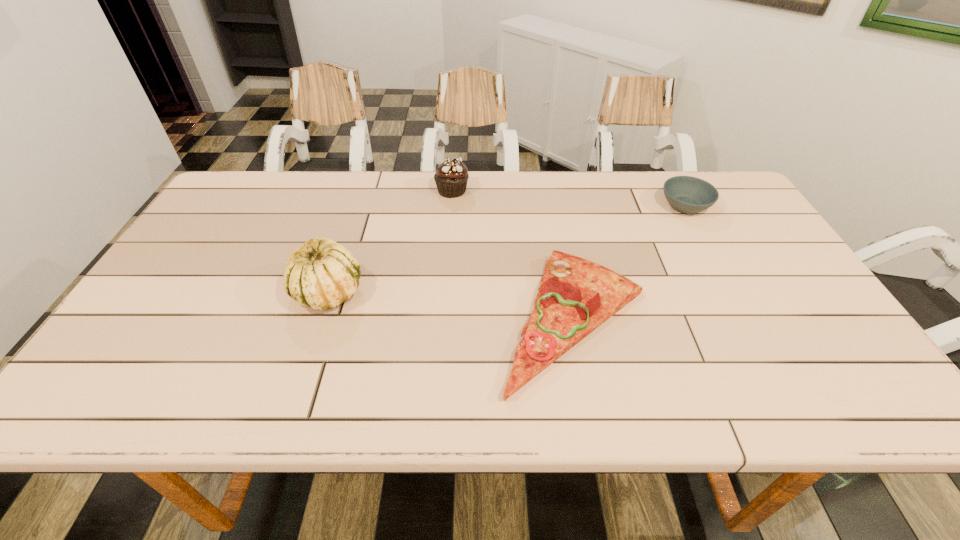
What are the coordinates of `vacant area that lies between the cupcake and the pizza` in the screenshot? It's located at (514, 255).

Where is `free spot between the second object from right to left and the third shortest object`? This screenshot has height=540, width=960. free spot between the second object from right to left and the third shortest object is located at coordinates (514, 255).

You are a GUI agent. You are given a task and a screenshot of the screen. Output one action in this format:
    pyautogui.click(x=<x>, y=<y>)
    Task: Click on the free space between the soup bowl and the second object from left to right
    
    Given the screenshot: What is the action you would take?
    pyautogui.click(x=568, y=198)

You are a GUI agent. You are given a task and a screenshot of the screen. Output one action in this format:
    pyautogui.click(x=<x>, y=<y>)
    Task: Click on the empty space between the soup bowl and the leftmost object
    This screenshot has height=540, width=960.
    Given the screenshot: What is the action you would take?
    pyautogui.click(x=507, y=249)

Where is `free spot between the third object from right to left and the tallest object`? The width and height of the screenshot is (960, 540). free spot between the third object from right to left and the tallest object is located at coordinates (390, 241).

The height and width of the screenshot is (540, 960). Find the location of `vacant area between the tallest object and the third object from left to right`. vacant area between the tallest object and the third object from left to right is located at coordinates (451, 305).

Where is `vacant area that lies between the rightmost object and the third object from right to left`? Image resolution: width=960 pixels, height=540 pixels. vacant area that lies between the rightmost object and the third object from right to left is located at coordinates (568, 198).

Where is `vacant point located between the second object from right to left and the second object from left to right`? The height and width of the screenshot is (540, 960). vacant point located between the second object from right to left and the second object from left to right is located at coordinates (514, 255).

Where is `vacant area that lies between the cupcake and the soup bowl`? The height and width of the screenshot is (540, 960). vacant area that lies between the cupcake and the soup bowl is located at coordinates (568, 198).

At what (x,y) coordinates should I click in order to perform the action: click on vacant area that lies between the third shortest object and the leftmost object. Please return your answer as a coordinate pair (x, y). The image size is (960, 540). Looking at the image, I should click on (390, 241).